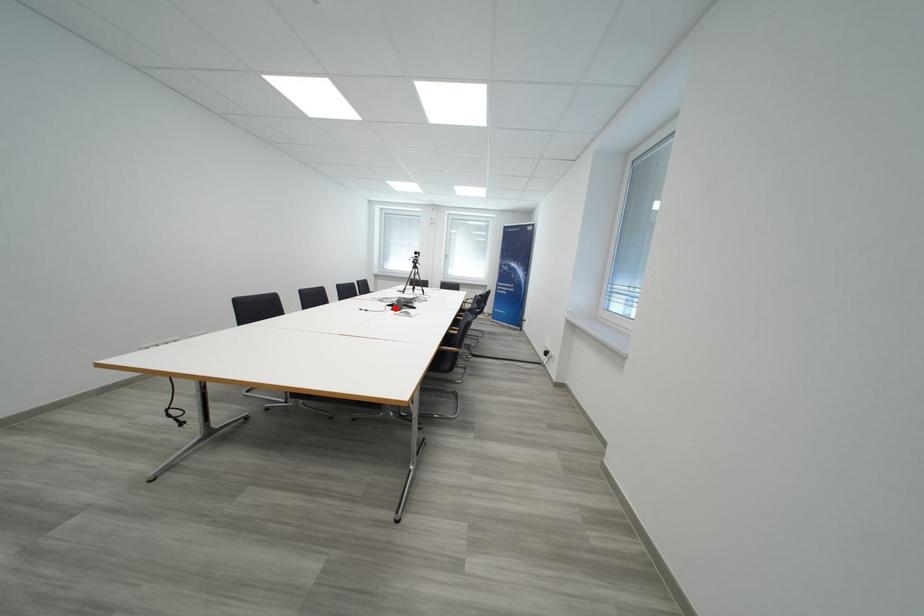
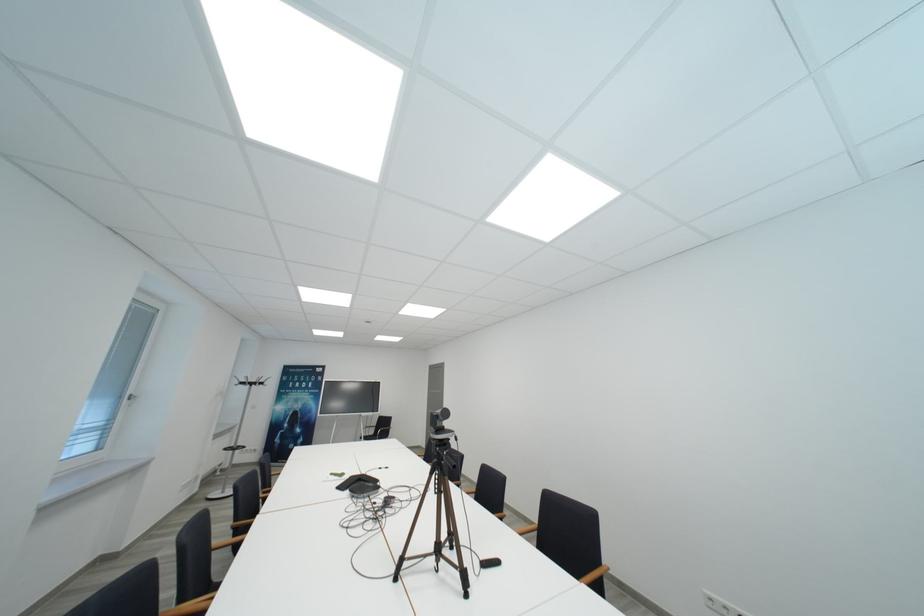
Question: I am providing you with two images of the same scene from different viewpoints. A red point is marked on the first image. At the location where the point appears in image 1, is it still visible in image 2?

Choices:
 (A) Yes
 (B) No

Answer: (B)